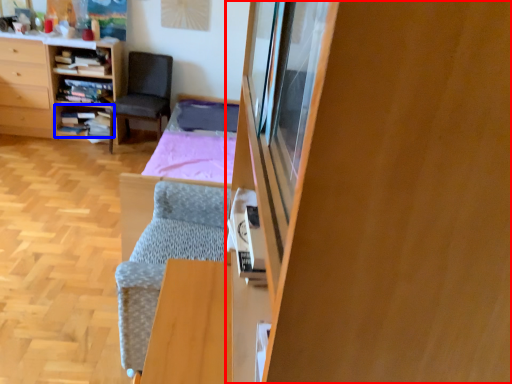
Question: Which object is further to the camera taking this photo, cabinetry (highlighted by a red box) or shelf (highlighted by a blue box)?

Choices:
 (A) cabinetry
 (B) shelf

Answer: (B)